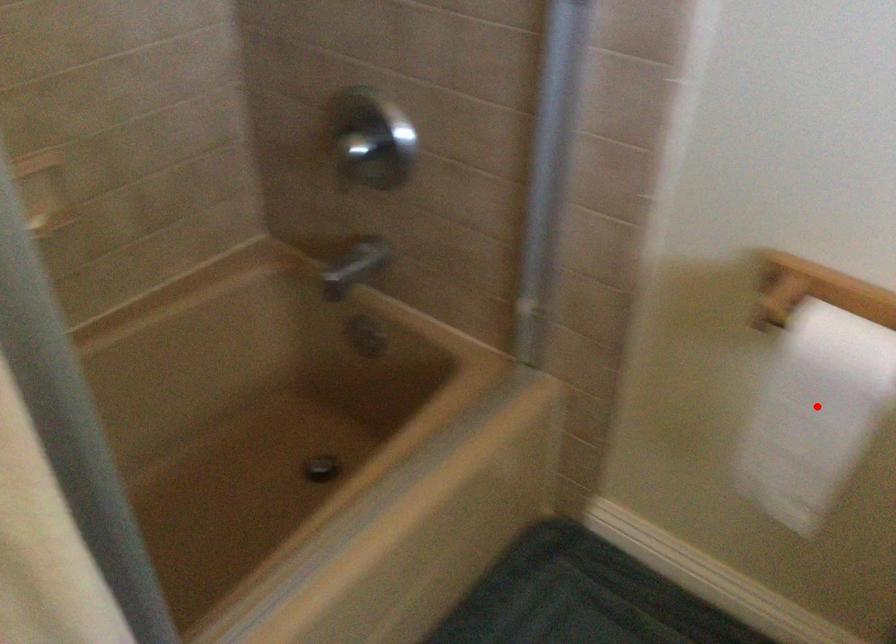
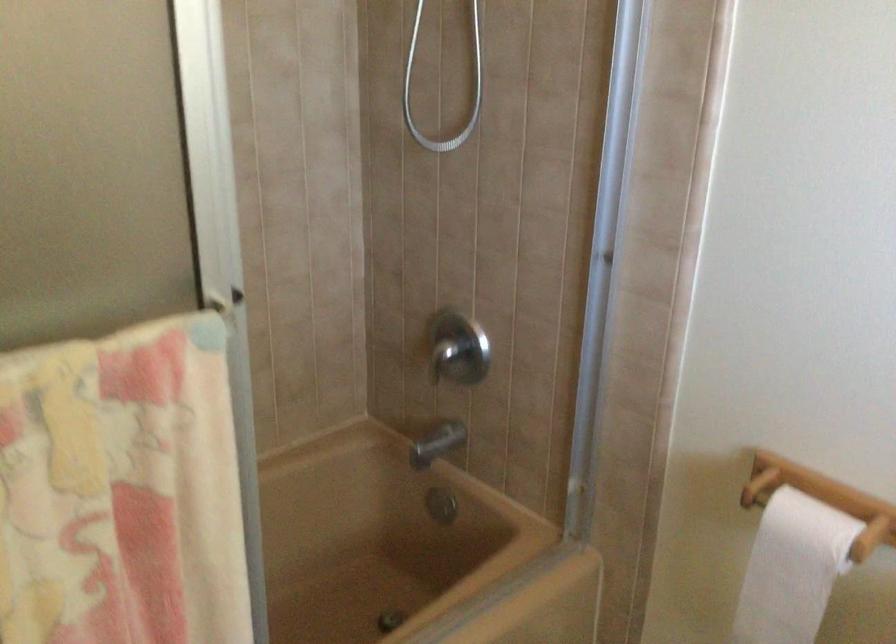
Question: I am providing you with two images of the same scene from different viewpoints. Given a red point in image1, look at the same physical point in image2. Is it:

Choices:
 (A) Closer to the viewpoint
 (B) Farther from the viewpoint

Answer: (B)